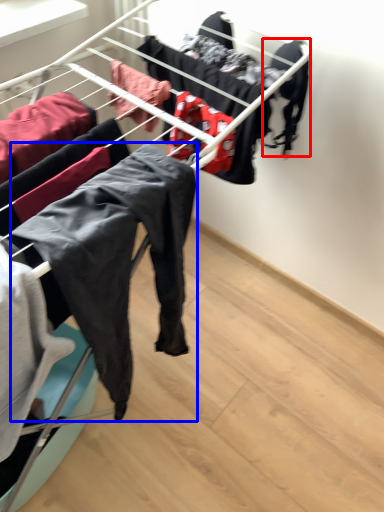
Question: Which point is further to the camera, clothing (highlighted by a red box) or clothing (highlighted by a blue box)?

Choices:
 (A) clothing
 (B) clothing

Answer: (A)